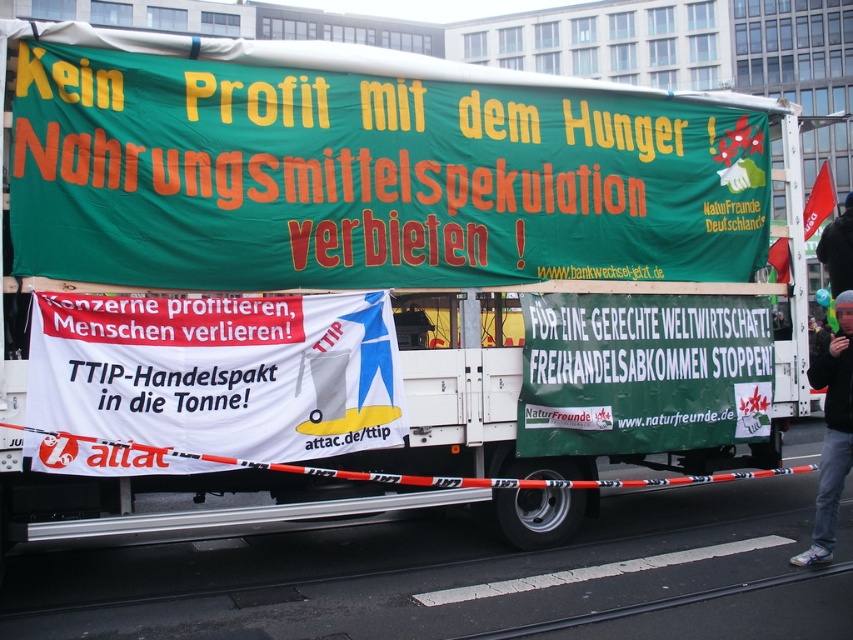
What is the spatial relationship between the green fabric banner at center and the black jacket at lower right?

The green fabric banner at center is above the black jacket at lower right.

What is the location of the point with coordinates (x=368, y=177) in the image?

The point with coordinates (x=368, y=177) is located on the green fabric banner at upper center.

You are a photographer standing 2 meters away from the truck. You want to take a photo that includes both the green fabric banner at center and the black jacket at lower right. Can you fit both objects in the frame of your camera, which has a maximum horizontal field of view of 1.2 meters?

The green fabric banner at center and the black jacket at lower right are 1.14 meters apart from each other. Since your camera has a maximum horizontal field of view of 1.2 meters, you can fit both objects in the frame as the distance between them is less than the field of view.